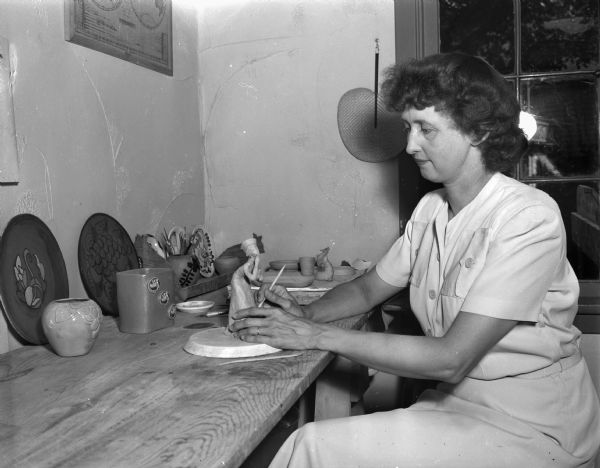
At what (x,y) coordinates should I click in order to perform the action: click on work surface. Please return your answer as a coordinate pair (x, y). The width and height of the screenshot is (600, 468). Looking at the image, I should click on (234, 345).